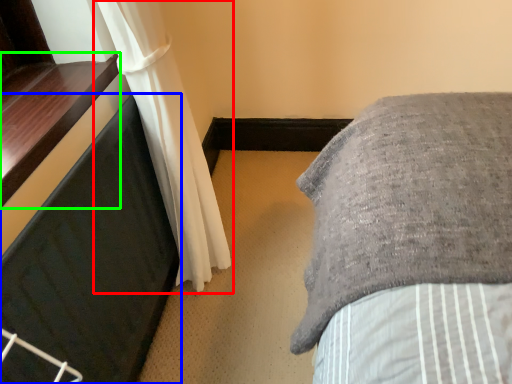
Question: Which is farther away from curtain (highlighted by a red box)? furniture (highlighted by a blue box) or window sill (highlighted by a green box)?

Choices:
 (A) furniture
 (B) window sill

Answer: (B)